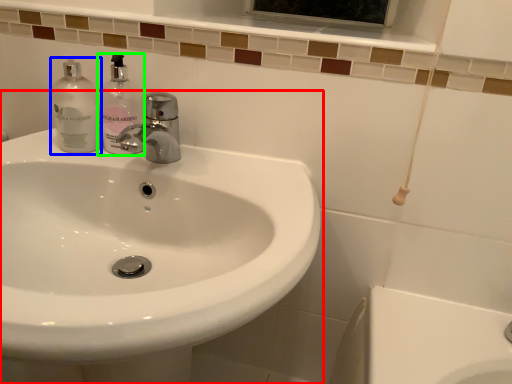
Question: Based on their relative distances, which object is farther from sink (highlighted by a red box)? Choose from cleaning product (highlighted by a blue box) and soap dispenser (highlighted by a green box).

Choices:
 (A) cleaning product
 (B) soap dispenser

Answer: (A)